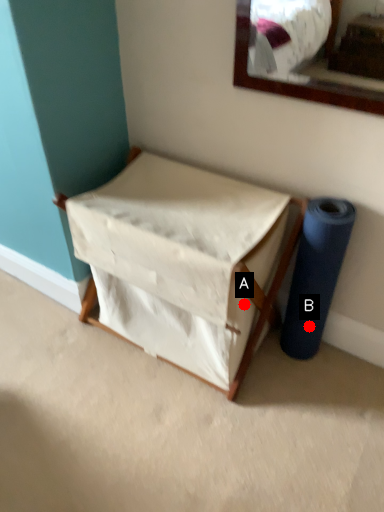
Question: Two points are circled on the image, labeled by A and B beside each circle. Which point is farther to the camera?

Choices:
 (A) A is further
 (B) B is further

Answer: (B)